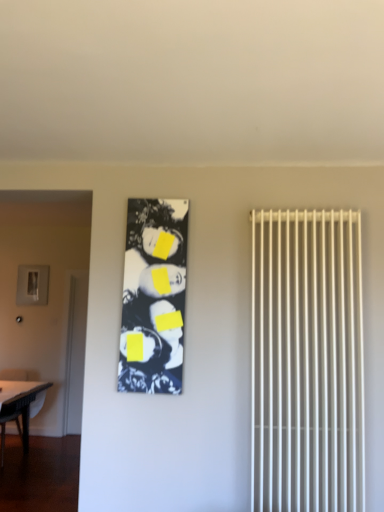
Question: Considering the relative sizes of black glossy photo frame at center and white glossy table at lower left in the image provided, is black glossy photo frame at center wider than white glossy table at lower left?

Choices:
 (A) no
 (B) yes

Answer: (A)

Question: Is black glossy photo frame at center turned away from white glossy table at lower left?

Choices:
 (A) no
 (B) yes

Answer: (A)

Question: Can you confirm if black glossy photo frame at center is positioned to the left of white glossy table at lower left?

Choices:
 (A) yes
 (B) no

Answer: (B)

Question: From the image's perspective, is black glossy photo frame at center above white glossy table at lower left?

Choices:
 (A) yes
 (B) no

Answer: (A)

Question: From a real-world perspective, is black glossy photo frame at center under white glossy table at lower left?

Choices:
 (A) yes
 (B) no

Answer: (B)

Question: Looking at the image, does white glossy table at lower left seem bigger or smaller compared to black glossy photo frame at center?

Choices:
 (A) big
 (B) small

Answer: (A)

Question: From a real-world perspective, is white glossy table at lower left above or below black glossy photo frame at center?

Choices:
 (A) below
 (B) above

Answer: (A)

Question: In terms of width, does white glossy table at lower left look wider or thinner when compared to black glossy photo frame at center?

Choices:
 (A) wide
 (B) thin

Answer: (A)

Question: From the image's perspective, is white glossy table at lower left positioned above or below black glossy photo frame at center?

Choices:
 (A) below
 (B) above

Answer: (A)

Question: Is matte gray screen door at left taller or shorter than black glossy photo frame at center?

Choices:
 (A) short
 (B) tall

Answer: (B)

Question: Based on their positions, is matte gray screen door at left located to the left or right of black glossy photo frame at center?

Choices:
 (A) left
 (B) right

Answer: (A)

Question: From a real-world perspective, relative to black glossy photo frame at center, is matte gray screen door at left vertically above or below?

Choices:
 (A) above
 (B) below

Answer: (B)

Question: In terms of width, does matte gray screen door at left look wider or thinner when compared to black glossy photo frame at center?

Choices:
 (A) thin
 (B) wide

Answer: (A)

Question: Is white plastic radiator at right taller or shorter than black glossy photo frame at center?

Choices:
 (A) short
 (B) tall

Answer: (B)

Question: Is white plastic radiator at right inside or outside of black glossy photo frame at center?

Choices:
 (A) inside
 (B) outside

Answer: (B)